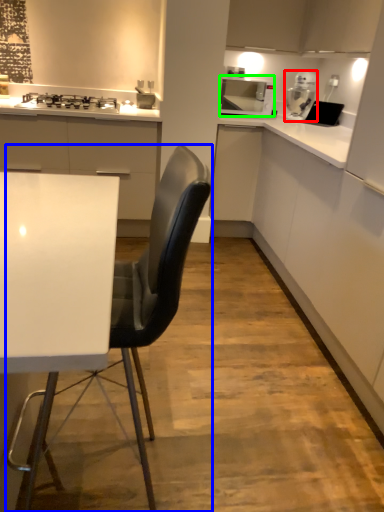
Question: Which is nearer to the kitchen appliance (highlighted by a red box)? chair (highlighted by a blue box) or home appliance (highlighted by a green box).

Choices:
 (A) chair
 (B) home appliance

Answer: (B)